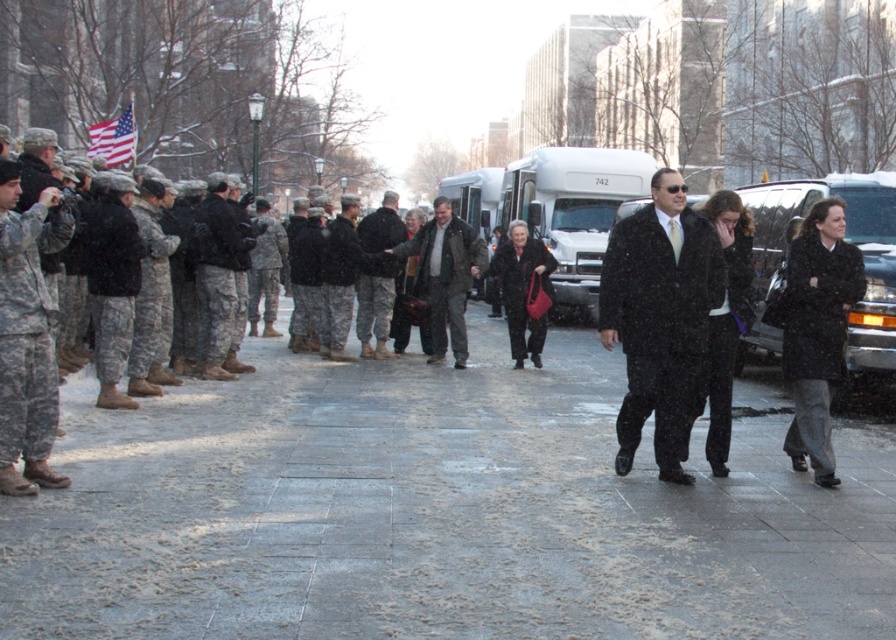
You are a photographer positioned at point (123, 120) and want to capture a photo of the military personnel at point (652, 310) without the civilians blocking the view. Can you move to a position that allows you to see the military personnel clearly?

Point (652, 310) is in front of point (123, 120), so moving to a position behind point (123, 120) would allow you to see the military personnel at point (652, 310) without obstruction from the civilians.

You are a photographer positioned at the back of the scene. You need to capture a photo that includes both the dark gray wool coat at center and the camouflage uniform at center. Which object should you adjust your focus to ensure both are in frame?

The dark gray wool coat at center is below the camouflage uniform at center, so you should adjust your focus to include the lower area where the dark gray wool coat at center is positioned while ensuring the camouflage uniform at center remains in view.

You are a photographer trying to capture a wide shot of the scene. You need to ensure both the gray concrete sidewalk at center and the camouflage uniform at center are fully visible. Given their sizes, which object should you focus on to frame the shot properly?

The gray concrete sidewalk at center has a larger size compared to the camouflage uniform at center. To frame the shot properly, you should focus on the gray concrete sidewalk at center since it occupies more space in the scene and will help establish the context for the camouflage uniform at center.